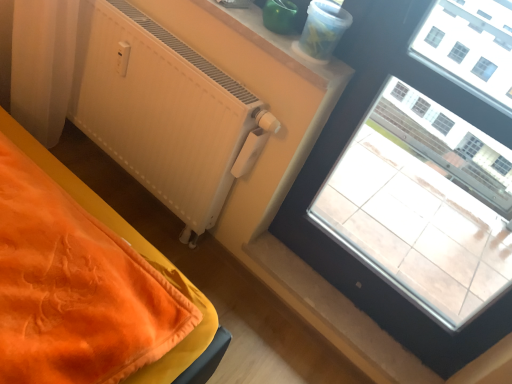
Question: From a real-world perspective, is smooth plastic container at upper center positioned above or below transparent glass window at upper right?

Choices:
 (A) below
 (B) above

Answer: (B)

Question: Considering the positions of smooth plastic container at upper center and transparent glass window at upper right in the image, is smooth plastic container at upper center taller or shorter than transparent glass window at upper right?

Choices:
 (A) tall
 (B) short

Answer: (B)

Question: Based on their relative distances, which object is nearer to the white matte radiator at upper left?

Choices:
 (A) transparent glass window at upper right
 (B) smooth plastic container at upper center

Answer: (B)

Question: Which object is the farthest from the transparent glass window at upper right?

Choices:
 (A) white matte radiator at upper left
 (B) smooth plastic container at upper center

Answer: (A)